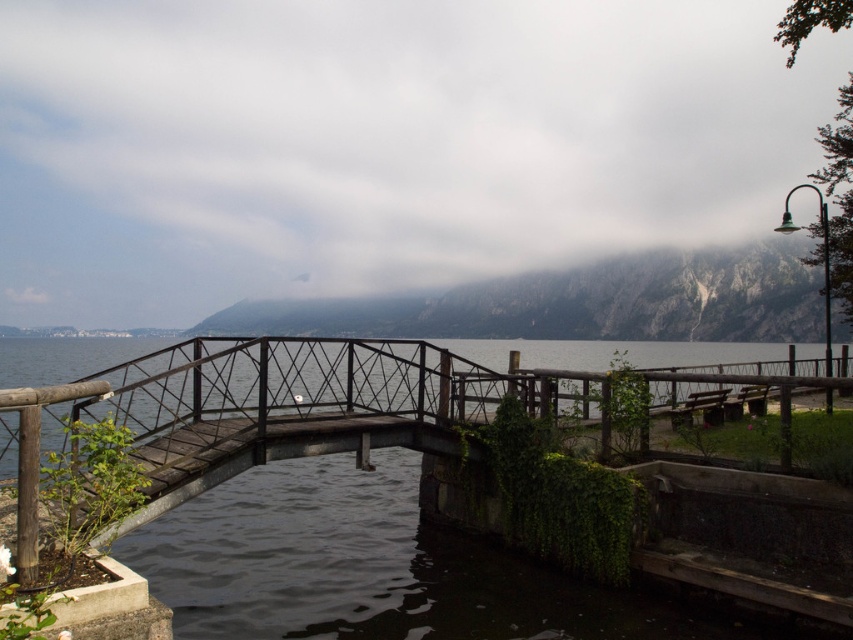
Is rusty metal bridge at center to the left of rocky gray mountain at upper center from the viewer's perspective?

Correct, you'll find rusty metal bridge at center to the left of rocky gray mountain at upper center.

Does rusty metal bridge at center lie in front of rocky gray mountain at upper center?

Yes, it is in front of rocky gray mountain at upper center.

Locate an element on the screen. Image resolution: width=853 pixels, height=640 pixels. rusty metal bridge at center is located at coordinates tap(288, 404).